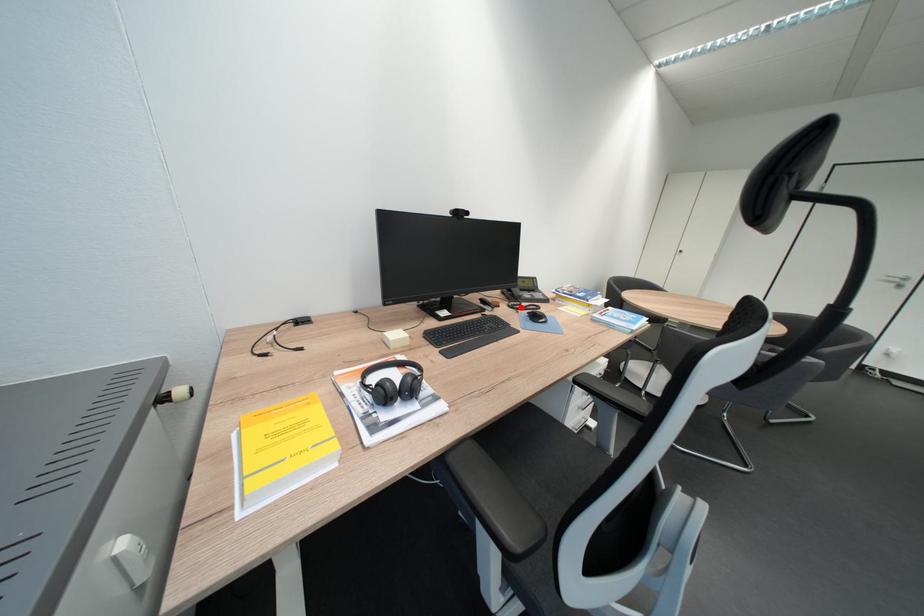
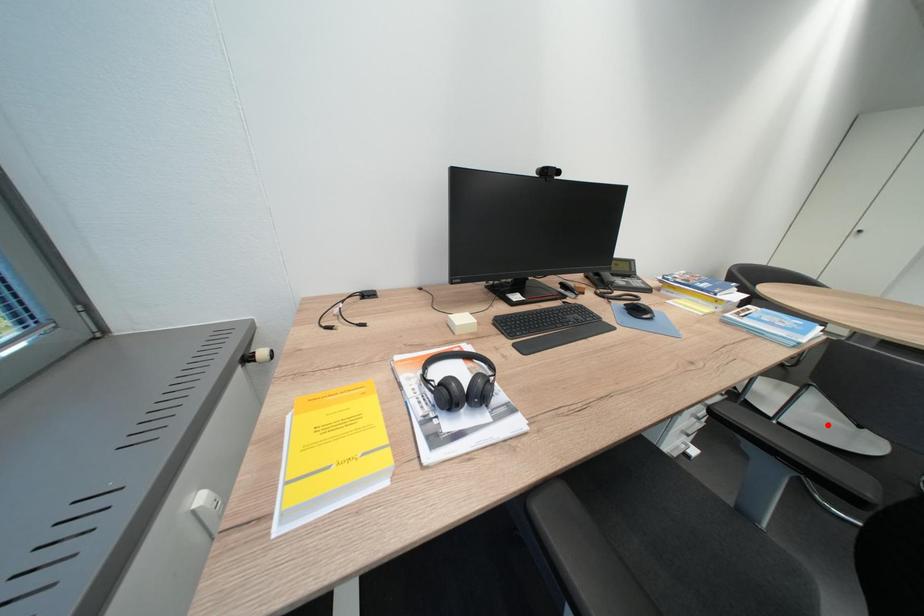
I am providing you with two images of the same scene from different viewpoints. A red point is marked on the first image and another point is marked on the second image. Is the red point in image1 aligned with the point shown in image2?

No